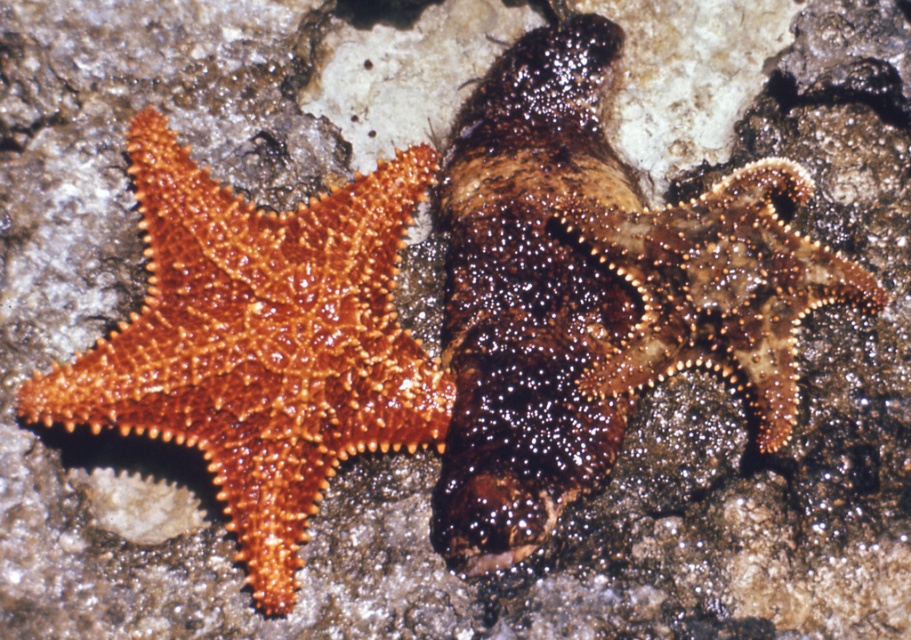
Question: Which of these objects is positioned farthest from the shiny brown starfish at center?

Choices:
 (A) brown spiny starfish at center
 (B) shiny orange starfish at left

Answer: (B)

Question: Is shiny brown starfish at center positioned at the back of brown spiny starfish at center?

Choices:
 (A) yes
 (B) no

Answer: (B)

Question: Among these objects, which one is nearest to the camera?

Choices:
 (A) brown spiny starfish at center
 (B) shiny brown starfish at center
 (C) shiny orange starfish at left

Answer: (C)

Question: Is shiny brown starfish at center further to the viewer compared to brown spiny starfish at center?

Choices:
 (A) yes
 (B) no

Answer: (B)

Question: Can you confirm if shiny orange starfish at left is positioned to the left of brown spiny starfish at center?

Choices:
 (A) yes
 (B) no

Answer: (A)

Question: Considering the real-world distances, which object is closest to the shiny orange starfish at left?

Choices:
 (A) shiny brown starfish at center
 (B) brown spiny starfish at center

Answer: (A)